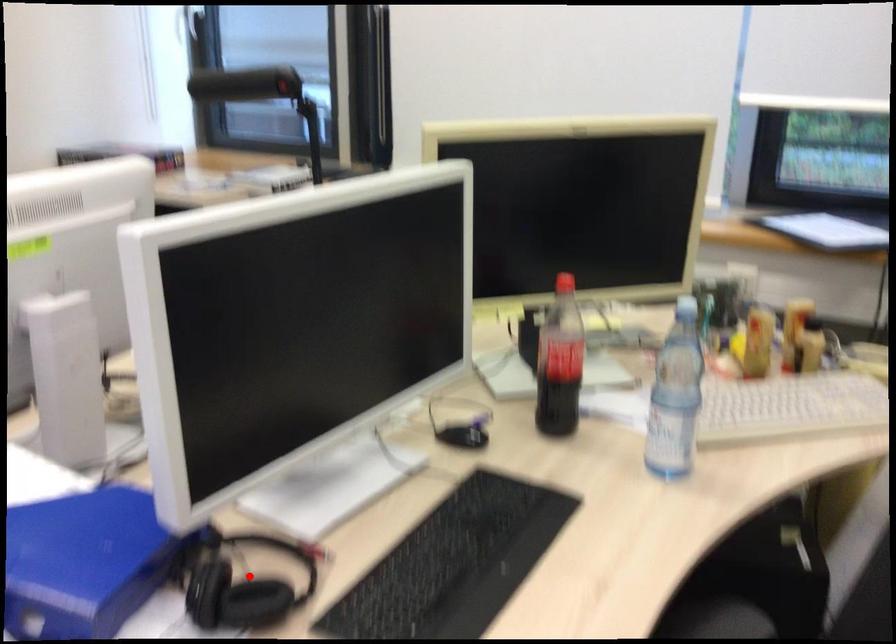
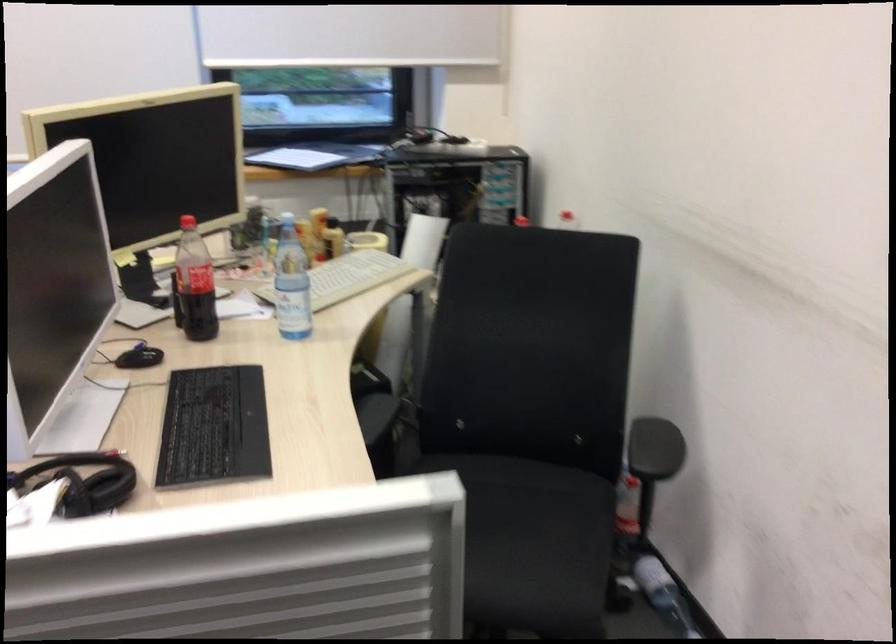
Where in the second image is the point corresponding to the highlighted location from the first image?

(81, 482)